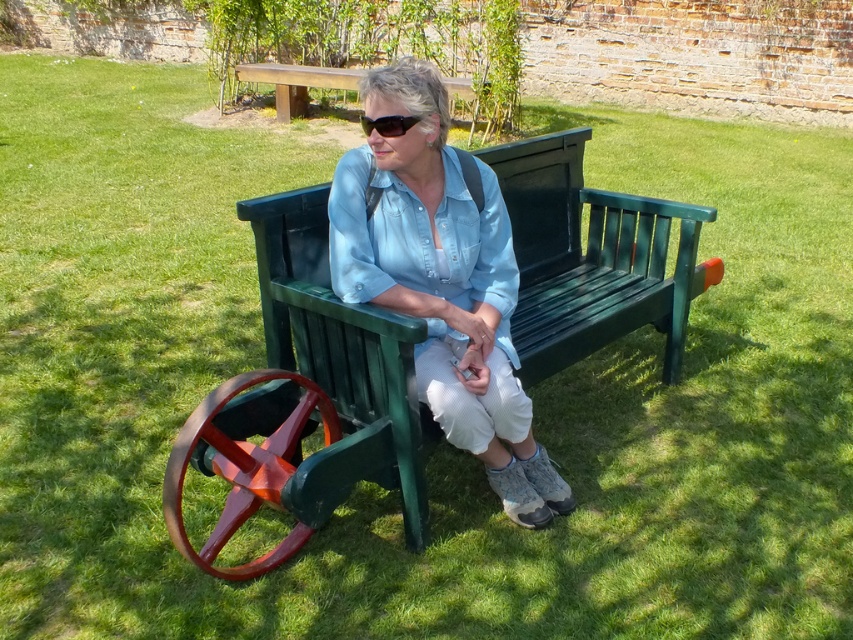
You are standing at the origin point in the image. Which direction should you move to reach the matte green bench at center?

Since the matte green bench at center is located at point (442, 280), you should move towards the center of the image to reach it.

You are a photographer positioned to the left of the scene. You want to capture a photo that includes both the matte green bench at center and the black plastic sunglasses at center. Which object should you adjust your camera angle to include first if the bench is blocking the sunglasses?

The matte green bench at center is to the right of the black plastic sunglasses at center. Since the bench is blocking the sunglasses, you should adjust your camera angle to include the black plastic sunglasses at center first by moving your position slightly to the left or right to ensure both are visible without obstruction.